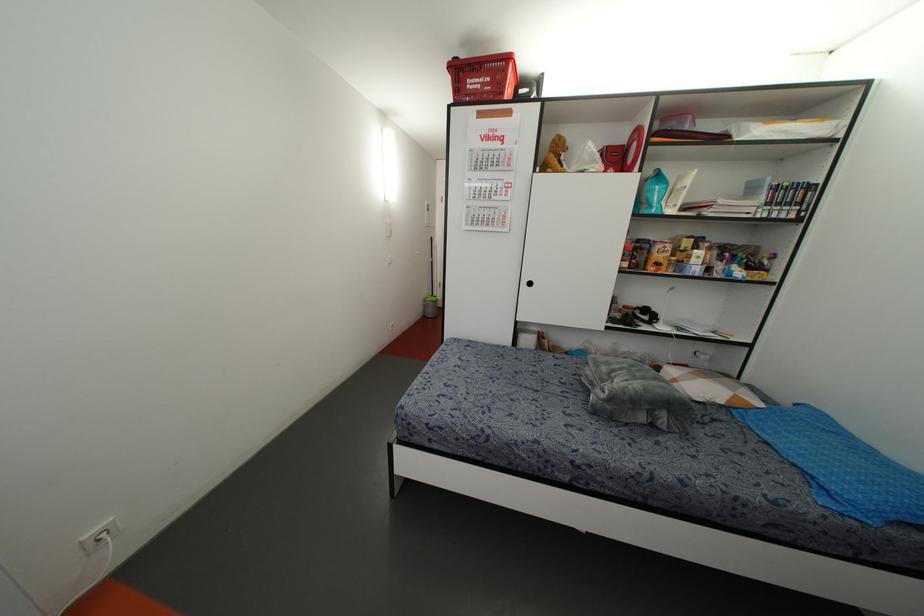
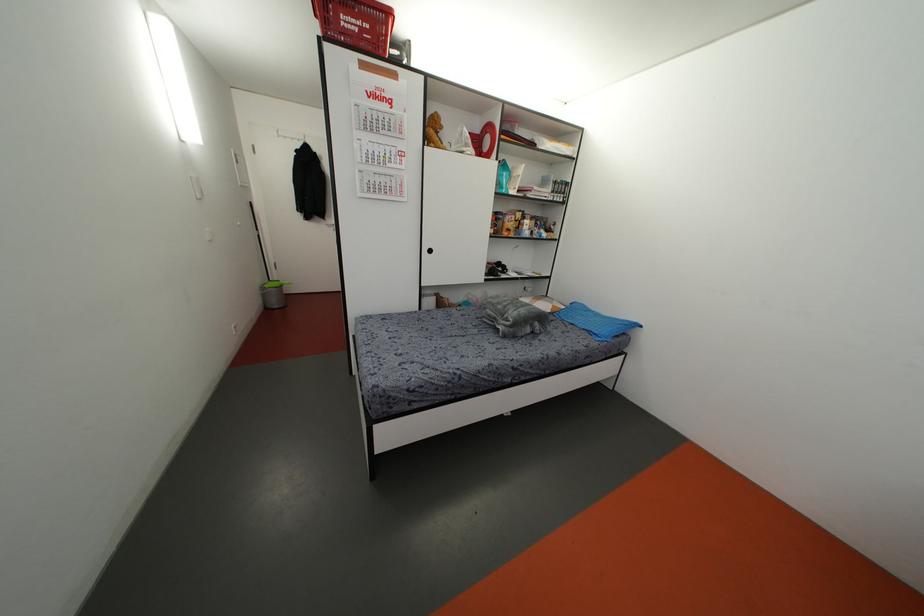
The point at (539, 456) is marked in the first image. Where is the corresponding point in the second image?

(493, 373)